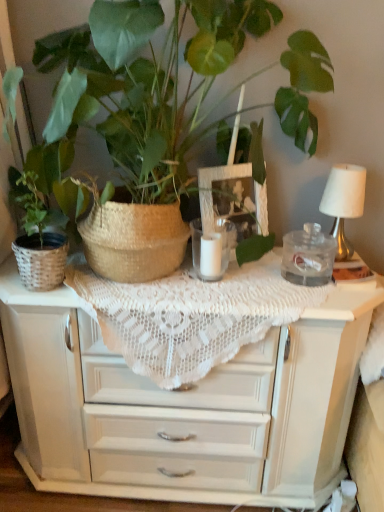
Question: Is clear glass jar at center outside of matte wicker basket at left, placed as the second houseplant when sorted from right to left?

Choices:
 (A) yes
 (B) no

Answer: (A)

Question: Is clear glass jar at center not close to matte wicker basket at left, placed as the second houseplant when sorted from right to left?

Choices:
 (A) yes
 (B) no

Answer: (B)

Question: From a real-world perspective, is clear glass jar at center beneath matte wicker basket at left, placed as the second houseplant when sorted from right to left?

Choices:
 (A) yes
 (B) no

Answer: (A)

Question: Considering the relative positions of clear glass jar at center and matte wicker basket at left, which ranks as the 1th houseplant in left-to-right order, in the image provided, is clear glass jar at center to the left of matte wicker basket at left, which ranks as the 1th houseplant in left-to-right order, from the viewer's perspective?

Choices:
 (A) yes
 (B) no

Answer: (B)

Question: Could you tell me if clear glass jar at center is turned towards matte wicker basket at left, which ranks as the 1th houseplant in left-to-right order?

Choices:
 (A) no
 (B) yes

Answer: (A)

Question: Would you say green woven basket at upper left, the first houseplant when ordered from right to left, is inside or outside white lace tablecloth at center?

Choices:
 (A) inside
 (B) outside

Answer: (B)

Question: Is green woven basket at upper left, the first houseplant when ordered from right to left, taller or shorter than white lace tablecloth at center?

Choices:
 (A) tall
 (B) short

Answer: (A)

Question: In the image, is green woven basket at upper left, the first houseplant when ordered from right to left, on the left side or the right side of white lace tablecloth at center?

Choices:
 (A) right
 (B) left

Answer: (B)

Question: In the image, is green woven basket at upper left, which is counted as the 2th houseplant, starting from the left, positioned in front of or behind white lace tablecloth at center?

Choices:
 (A) behind
 (B) front

Answer: (B)

Question: Looking at their shapes, would you say matte wicker basket at left, placed as the second houseplant when sorted from right to left, is wider or thinner than clear glass jar at center?

Choices:
 (A) thin
 (B) wide

Answer: (B)

Question: From the image's perspective, is matte wicker basket at left, which ranks as the 1th houseplant in left-to-right order, above or below clear glass jar at center?

Choices:
 (A) above
 (B) below

Answer: (A)

Question: Would you say matte wicker basket at left, placed as the second houseplant when sorted from right to left, is to the left or to the right of clear glass jar at center in the picture?

Choices:
 (A) left
 (B) right

Answer: (A)

Question: Which is correct: matte wicker basket at left, placed as the second houseplant when sorted from right to left, is inside clear glass jar at center, or outside of it?

Choices:
 (A) outside
 (B) inside

Answer: (A)

Question: Looking at their shapes, would you say white lace tablecloth at center is wider or thinner than green woven basket at upper left, which is counted as the 2th houseplant, starting from the left?

Choices:
 (A) thin
 (B) wide

Answer: (A)

Question: In the image, is white lace tablecloth at center positioned in front of or behind green woven basket at upper left, which is counted as the 2th houseplant, starting from the left?

Choices:
 (A) behind
 (B) front

Answer: (A)